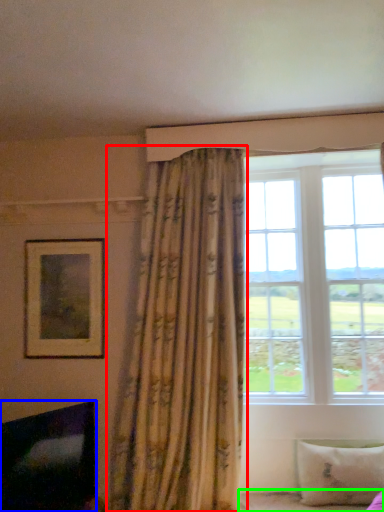
Question: Which object is positioned closest to curtain (highlighted by a red box)? Select from fireplace (highlighted by a blue box) and bed frame (highlighted by a green box).

Choices:
 (A) fireplace
 (B) bed frame

Answer: (A)